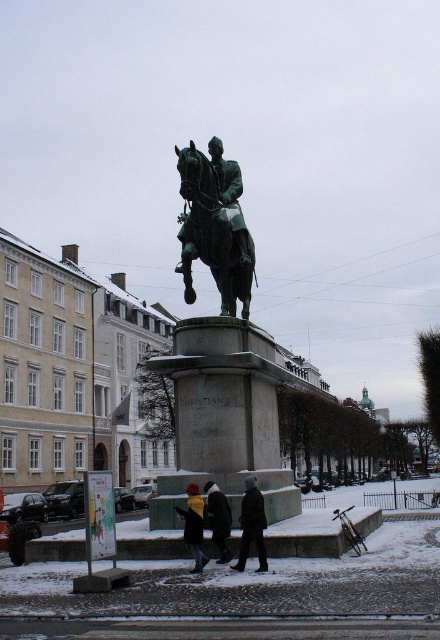
Question: Which object is the farthest from the dark gray jacket at center?

Choices:
 (A) black wool coat at center
 (B) green polished metal horse at center

Answer: (B)

Question: Does green polished metal horse at center appear on the right side of black wool coat at center?

Choices:
 (A) no
 (B) yes

Answer: (A)

Question: Is dark gray jacket at center below yellow wool sweater at lower center?

Choices:
 (A) no
 (B) yes

Answer: (A)

Question: Which is farther from the green polished metal horse at center?

Choices:
 (A) dark gray jacket at center
 (B) black wool coat at center
 (C) yellow wool sweater at lower center

Answer: (C)

Question: Which object is farther from the camera taking this photo?

Choices:
 (A) black wool coat at center
 (B) green polished metal horse at center

Answer: (B)

Question: Does dark gray jacket at center appear over yellow wool sweater at lower center?

Choices:
 (A) no
 (B) yes

Answer: (B)